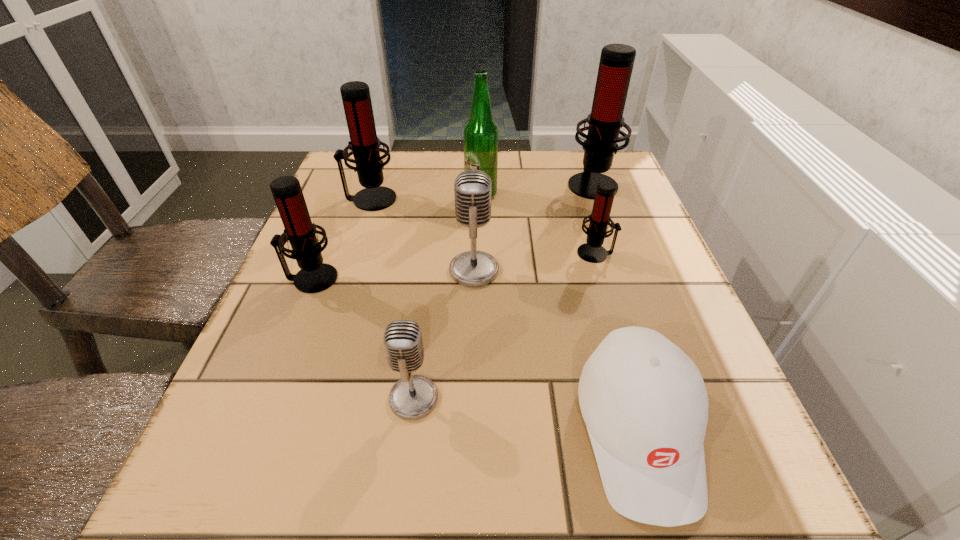
Find the location of a particular element. baseball cap present at the right edge is located at coordinates (644, 402).

Identify the location of object at the far left corner. (364, 144).

I want to click on object located in the far right corner section of the desktop, so [616, 63].

Find the location of a particular element. object located in the near right corner section of the desktop is located at coordinates (644, 402).

I want to click on vacant space at the far edge of the desktop, so click(x=530, y=151).

This screenshot has width=960, height=540. I want to click on blank space at the near edge of the desktop, so click(441, 492).

This screenshot has height=540, width=960. I want to click on vacant space at the left edge of the desktop, so click(x=348, y=315).

I want to click on blank area at the far left corner, so click(340, 187).

The height and width of the screenshot is (540, 960). In order to click on free spot at the near left corner of the desktop in this screenshot , I will do `click(204, 474)`.

I want to click on vacant point located between the nearest red microphone and the baseball cap, so click(475, 355).